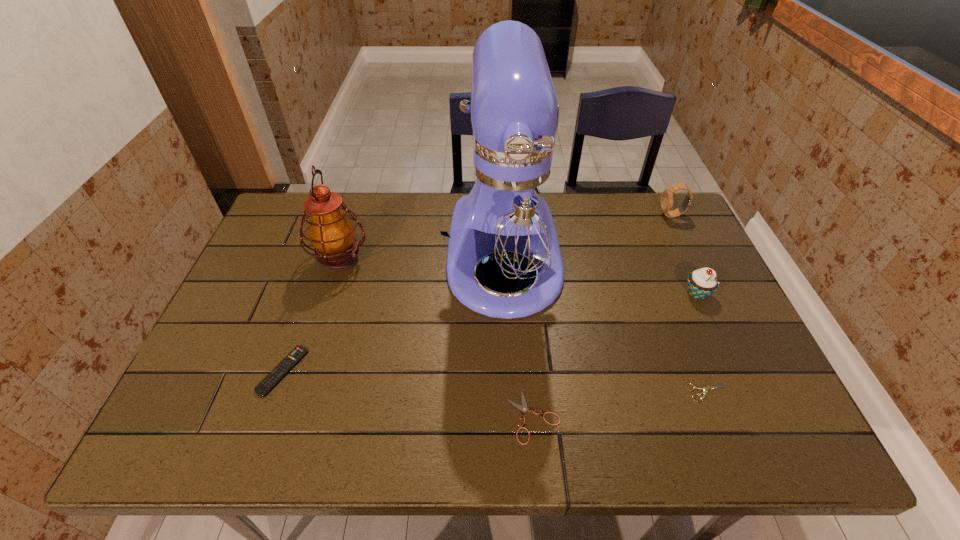
Find the location of a particular element. vacant space located on the face of the watch is located at coordinates (560, 215).

Locate an element on the screen. The height and width of the screenshot is (540, 960). blank space located 0.350m on the face of the watch is located at coordinates (554, 215).

Find the location of a particular element. The width and height of the screenshot is (960, 540). vacant region located on the front of the cupcake is located at coordinates (759, 429).

In order to click on vacant space located 0.160m on the back of the fifth tallest object in this screenshot , I will do `click(308, 299)`.

You are a GUI agent. You are given a task and a screenshot of the screen. Output one action in this format:
    pyautogui.click(x=<x>, y=<y>)
    Task: Click on the vacant space located on the back of the left shears
    
    Given the screenshot: What is the action you would take?
    pyautogui.click(x=524, y=316)

Find the location of a particular element. This screenshot has width=960, height=540. free space located on the back of the right shears is located at coordinates (683, 332).

Where is `mixer located at the far edge`? mixer located at the far edge is located at coordinates (509, 213).

The width and height of the screenshot is (960, 540). I want to click on watch that is at the far edge, so click(667, 196).

Where is `object located in the near edge section of the desktop`? The width and height of the screenshot is (960, 540). object located in the near edge section of the desktop is located at coordinates (523, 408).

You are a GUI agent. You are given a task and a screenshot of the screen. Output one action in this format:
    pyautogui.click(x=<x>, y=<y>)
    Task: Click on the object located in the left edge section of the desktop
    This screenshot has width=960, height=540.
    Given the screenshot: What is the action you would take?
    pyautogui.click(x=298, y=353)